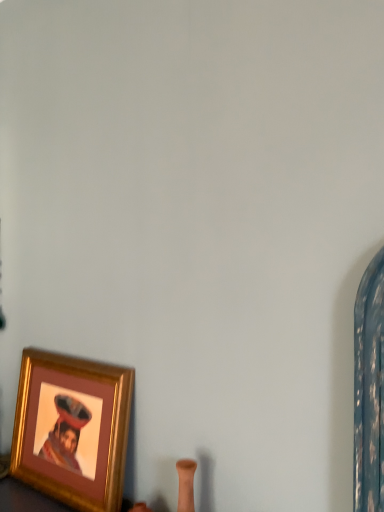
Question: Should I look upward or downward to see gold-framed picture at lower left?

Choices:
 (A) up
 (B) down

Answer: (B)